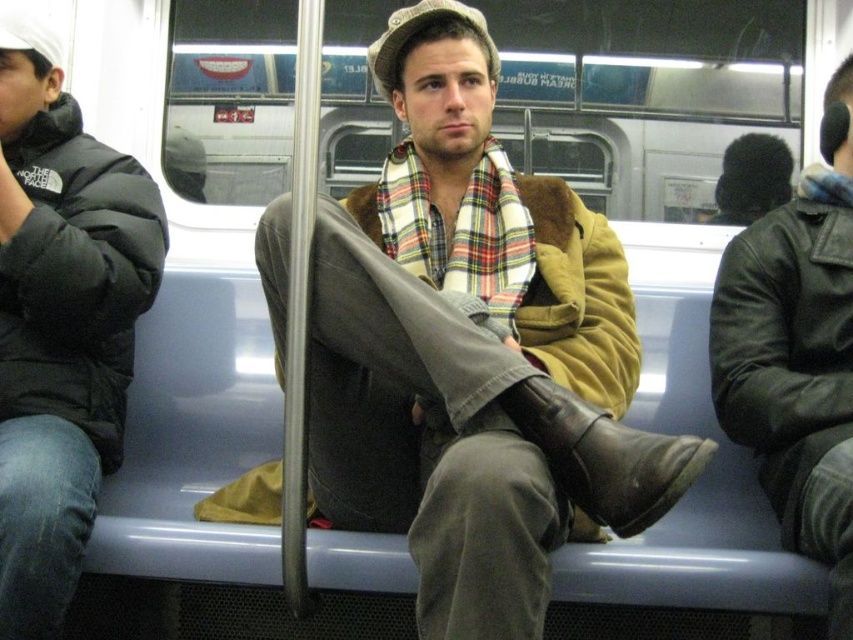
Is black puffy jacket at left thinner than black fuzzy hat at upper right?

No.

Who is lower down, black puffy jacket at left or black fuzzy hat at upper right?

Positioned lower is black puffy jacket at left.

What do you see at coordinates (61, 321) in the screenshot?
I see `black puffy jacket at left` at bounding box center [61, 321].

Locate an element on the screen. Image resolution: width=853 pixels, height=640 pixels. black puffy jacket at left is located at coordinates (61, 321).

Is brown fuzzy coat at center positioned in front of black puffy jacket at left?

Yes.

Which is more to the left, brown fuzzy coat at center or black puffy jacket at left?

Positioned to the left is black puffy jacket at left.

Locate an element on the screen. Image resolution: width=853 pixels, height=640 pixels. brown fuzzy coat at center is located at coordinates (466, 344).

Can you confirm if brown fuzzy coat at center is thinner than leather jacket at right?

In fact, brown fuzzy coat at center might be wider than leather jacket at right.

Does point (541, 392) lie in front of point (821, 557)?

Yes, it is.

Where is `brown fuzzy coat at center`? The height and width of the screenshot is (640, 853). brown fuzzy coat at center is located at coordinates (466, 344).